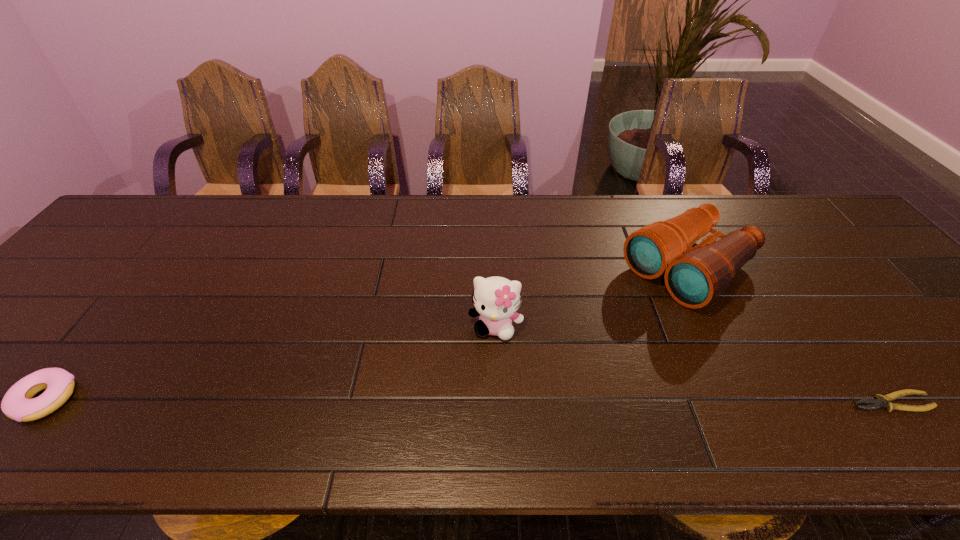
Find the location of a particular element. This screenshot has width=960, height=540. pliers is located at coordinates (880, 402).

Find the location of a particular element. This screenshot has height=540, width=960. the rightmost object is located at coordinates (880, 402).

At what (x,y) coordinates should I click in order to perform the action: click on the third object from right to left. Please return your answer as a coordinate pair (x, y). This screenshot has height=540, width=960. Looking at the image, I should click on (496, 300).

Identify the location of the third object from left to right. (695, 276).

At what (x,y) coordinates should I click in order to perform the action: click on blank area located 0.340m on the back of the pliers. Please return your answer as a coordinate pair (x, y). The width and height of the screenshot is (960, 540). Looking at the image, I should click on (799, 279).

Locate an element on the screen. The height and width of the screenshot is (540, 960). vacant space located 0.080m on the front-facing side of the kitten is located at coordinates (487, 372).

The width and height of the screenshot is (960, 540). I want to click on blank area located 0.060m on the front-facing side of the kitten, so click(488, 364).

Find the location of a particular element. vacant space located 0.080m on the front-facing side of the kitten is located at coordinates (487, 372).

The width and height of the screenshot is (960, 540). I want to click on blank space located through the lenses of the binoculars, so click(577, 346).

I want to click on vacant space located 0.180m through the lenses of the binoculars, so click(x=597, y=332).